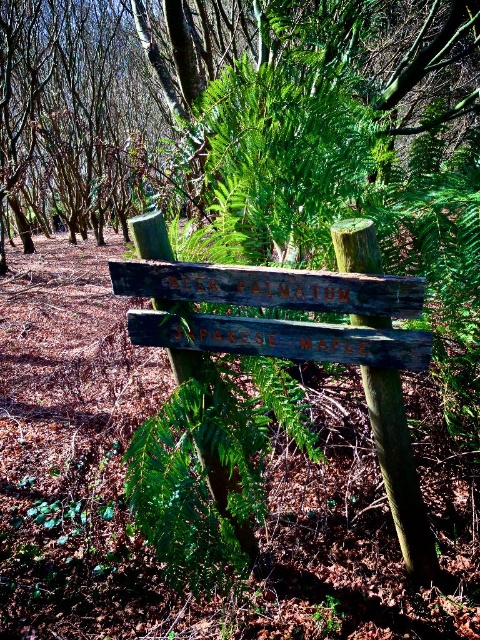
You are a hiker trying to read both the green wood sign at center and the weathered wood sign at center. Which sign is wider?

The green wood sign at center is wider than the weathered wood sign at center.

You are a hiker who just arrived at the woodland scene. You see the green wood sign at center and the weathered wood sign at center. Which one is closer to you?

The green wood sign at center is closer to you because the weathered wood sign at center is behind it.

You are standing in a forest and see two points marked in the scene. Which point is closer to you, point (8, 67) or point (385, 481)?

Point (8, 67) is closer to you than point (385, 481).